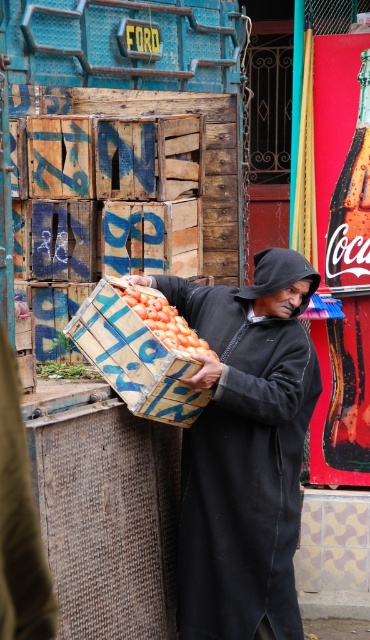
Question: Can you confirm if black matte robe at center is positioned to the right of smooth orange tomatoes at center?

Choices:
 (A) no
 (B) yes

Answer: (B)

Question: Does black matte robe at center appear on the left side of smooth orange tomatoes at center?

Choices:
 (A) no
 (B) yes

Answer: (A)

Question: Among these objects, which one is farthest from the camera?

Choices:
 (A) smooth orange tomatoes at center
 (B) black matte robe at center

Answer: (B)

Question: Can you confirm if black matte robe at center is positioned to the left of smooth orange tomatoes at center?

Choices:
 (A) yes
 (B) no

Answer: (B)

Question: Which point appears farthest from the camera in this image?

Choices:
 (A) (206, 348)
 (B) (290, 449)

Answer: (B)

Question: Which point is farther to the camera?

Choices:
 (A) black matte robe at center
 (B) smooth orange tomatoes at center

Answer: (A)